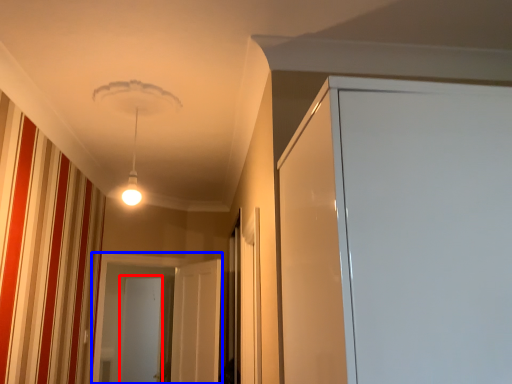
Question: Which of the following is the closest to the observer, screen door (highlighted by a red box) or screen door (highlighted by a blue box)?

Choices:
 (A) screen door
 (B) screen door

Answer: (B)